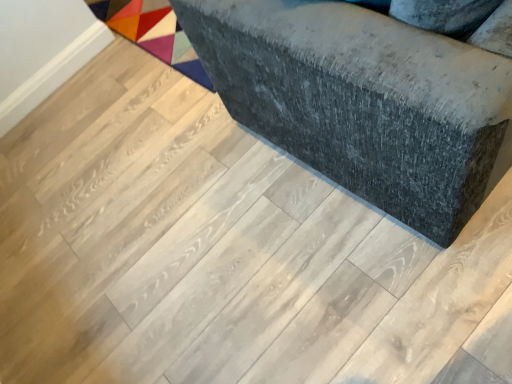
Identify the location of dark gray fabric ottoman at center. This screenshot has height=384, width=512. (364, 101).

What do you see at coordinates (364, 101) in the screenshot?
I see `dark gray fabric ottoman at center` at bounding box center [364, 101].

The image size is (512, 384). Describe the element at coordinates (153, 33) in the screenshot. I see `multicolored fabric mat at upper left` at that location.

Identify the location of multicolored fabric mat at upper left. Image resolution: width=512 pixels, height=384 pixels. (153, 33).

This screenshot has width=512, height=384. Identify the location of dark gray fabric ottoman at center. (364, 101).

Between multicolored fabric mat at upper left and dark gray fabric ottoman at center, which one appears on the right side from the viewer's perspective?

Positioned to the right is dark gray fabric ottoman at center.

Which object is more forward, multicolored fabric mat at upper left or dark gray fabric ottoman at center?

dark gray fabric ottoman at center.

Which point is more forward, (196, 64) or (377, 123)?

The point (377, 123) is more forward.

Based on the photo, from the image's perspective, which object appears higher, multicolored fabric mat at upper left or dark gray fabric ottoman at center?

multicolored fabric mat at upper left, from the image's perspective.

From a real-world perspective, is multicolored fabric mat at upper left located beneath dark gray fabric ottoman at center?

Yes.

Is multicolored fabric mat at upper left wider than dark gray fabric ottoman at center?

Yes.

Between multicolored fabric mat at upper left and dark gray fabric ottoman at center, which one has less height?

Standing shorter between the two is multicolored fabric mat at upper left.

Can you confirm if multicolored fabric mat at upper left is bigger than dark gray fabric ottoman at center?

No.

Is multicolored fabric mat at upper left inside or outside of dark gray fabric ottoman at center?

multicolored fabric mat at upper left lies outside dark gray fabric ottoman at center.

Is multicolored fabric mat at upper left positioned far away from dark gray fabric ottoman at center?

No.

Could you tell me if multicolored fabric mat at upper left is facing dark gray fabric ottoman at center?

Yes, multicolored fabric mat at upper left faces towards dark gray fabric ottoman at center.

Identify the location of furniture lying in front of the multicolored fabric mat at upper left. (364, 101).

Does dark gray fabric ottoman at center appear on the right side of multicolored fabric mat at upper left?

Yes, dark gray fabric ottoman at center is to the right of multicolored fabric mat at upper left.

Considering their positions, is dark gray fabric ottoman at center located in front of or behind multicolored fabric mat at upper left?

dark gray fabric ottoman at center is in front of multicolored fabric mat at upper left.

Does point (389, 144) come closer to viewer compared to point (190, 70)?

Yes, point (389, 144) is closer to viewer.

From the image's perspective, does dark gray fabric ottoman at center appear lower than multicolored fabric mat at upper left?

Correct, dark gray fabric ottoman at center appears lower than multicolored fabric mat at upper left in the image.

From a real-world perspective, between dark gray fabric ottoman at center and multicolored fabric mat at upper left, who is vertically higher?

dark gray fabric ottoman at center, from a real-world perspective.

Considering the relative sizes of dark gray fabric ottoman at center and multicolored fabric mat at upper left in the image provided, is dark gray fabric ottoman at center wider than multicolored fabric mat at upper left?

Incorrect, the width of dark gray fabric ottoman at center does not surpass that of multicolored fabric mat at upper left.

Is dark gray fabric ottoman at center taller or shorter than multicolored fabric mat at upper left?

Clearly, dark gray fabric ottoman at center is taller compared to multicolored fabric mat at upper left.

Does dark gray fabric ottoman at center have a smaller size compared to multicolored fabric mat at upper left?

Incorrect, dark gray fabric ottoman at center is not smaller in size than multicolored fabric mat at upper left.

Is dark gray fabric ottoman at center not within multicolored fabric mat at upper left?

Indeed, dark gray fabric ottoman at center is completely outside multicolored fabric mat at upper left.

Are dark gray fabric ottoman at center and multicolored fabric mat at upper left beside each other?

There is a gap between dark gray fabric ottoman at center and multicolored fabric mat at upper left.

Is dark gray fabric ottoman at center facing away from multicolored fabric mat at upper left?

dark gray fabric ottoman at center does not have its back to multicolored fabric mat at upper left.

How much distance is there between dark gray fabric ottoman at center and multicolored fabric mat at upper left?

They are 88.37 centimeters apart.

At what (x,y) coordinates should I click in order to perform the action: click on furniture lying on the right of multicolored fabric mat at upper left. Please return your answer as a coordinate pair (x, y). This screenshot has width=512, height=384. Looking at the image, I should click on (364, 101).

The height and width of the screenshot is (384, 512). Identify the location of mat that appears below the dark gray fabric ottoman at center (from a real-world perspective). (153, 33).

Locate an element on the screen. The image size is (512, 384). furniture below the multicolored fabric mat at upper left (from the image's perspective) is located at coordinates (364, 101).